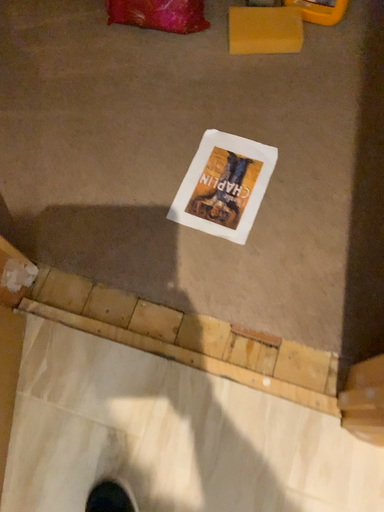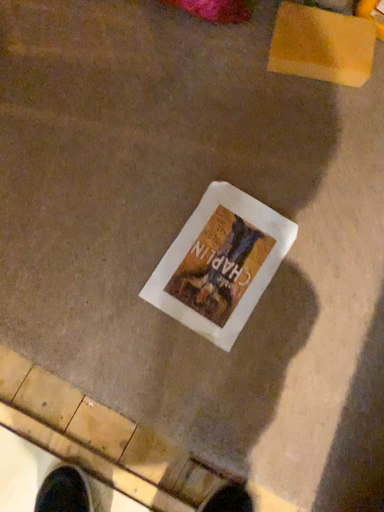
Question: How did the camera likely rotate when shooting the video?

Choices:
 (A) rotated upward
 (B) rotated downward

Answer: (B)